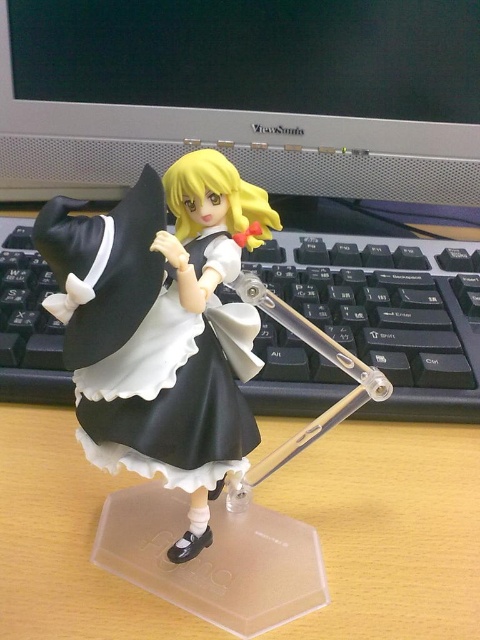
Between black matte maid outfit at center and black satin dress at center, which one has more height?

black matte maid outfit at center is taller.

Is point (83, 353) farther from camera compared to point (240, 451)?

No.

Where is `black matte maid outfit at center`? black matte maid outfit at center is located at coordinates (162, 326).

Is satin silver monitor at upper center to the left of black satin dress at center from the viewer's perspective?

In fact, satin silver monitor at upper center is to the right of black satin dress at center.

Between point (467, 131) and point (211, 432), which one is positioned in front?

Point (211, 432) is in front.

Image resolution: width=480 pixels, height=640 pixels. What do you see at coordinates (226, 147) in the screenshot?
I see `satin silver monitor at upper center` at bounding box center [226, 147].

At what (x,y) coordinates should I click in order to perform the action: click on satin silver monitor at upper center. Please return your answer as a coordinate pair (x, y). This screenshot has width=480, height=640. Looking at the image, I should click on [x=226, y=147].

Is point (226, 449) positioned after point (142, 154)?

No, it is in front of (142, 154).

Based on the photo, which is more to the left, black matte maid outfit at center or satin silver monitor at upper center?

Positioned to the left is black matte maid outfit at center.

Identify the location of black matte maid outfit at center. (162, 326).